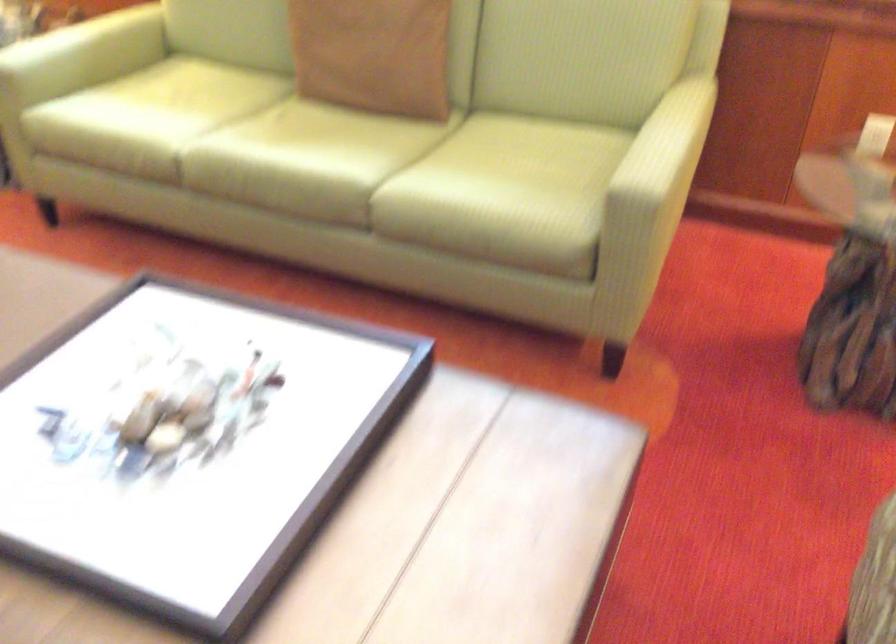
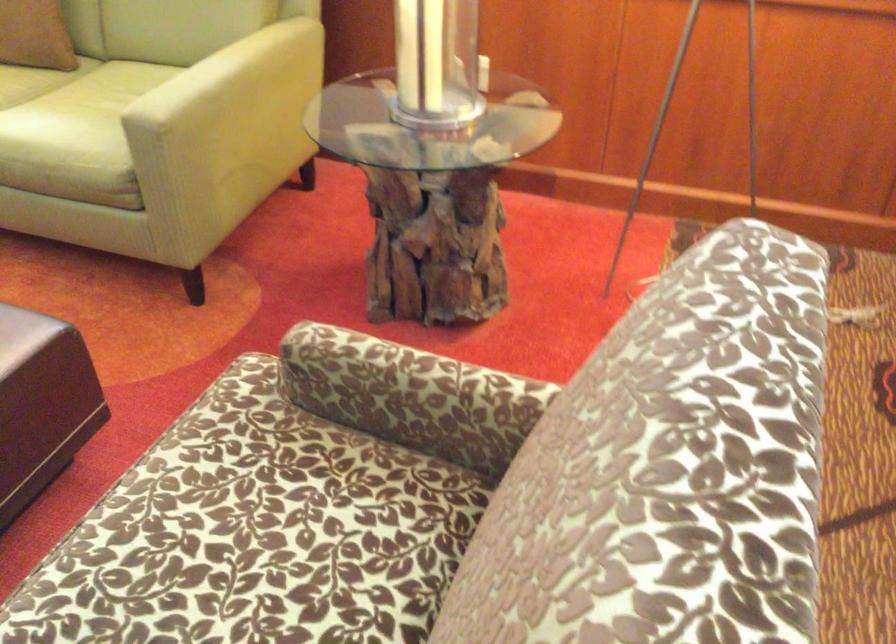
Question: In a continuous first-person perspective shot, in which direction is the camera moving?

Choices:
 (A) Left
 (B) Right
 (C) Forward
 (D) Backward

Answer: (B)